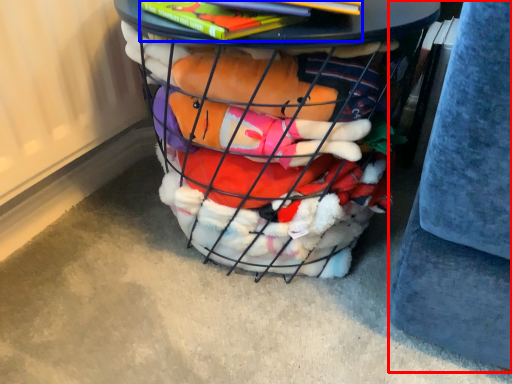
Question: Which object appears closest to the camera in this image, gray (highlighted by a red box) or book (highlighted by a blue box)?

Choices:
 (A) gray
 (B) book

Answer: (A)